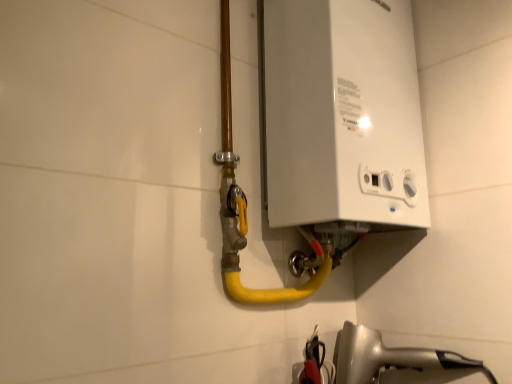
Question: Does white plastic boiler at upper right have a greater height compared to white glossy hairdryer at lower right?

Choices:
 (A) no
 (B) yes

Answer: (B)

Question: Can you confirm if white plastic boiler at upper right is smaller than white glossy hairdryer at lower right?

Choices:
 (A) yes
 (B) no

Answer: (B)

Question: Is white plastic boiler at upper right to the left of white glossy hairdryer at lower right from the viewer's perspective?

Choices:
 (A) no
 (B) yes

Answer: (B)

Question: From a real-world perspective, is white plastic boiler at upper right positioned under white glossy hairdryer at lower right based on gravity?

Choices:
 (A) yes
 (B) no

Answer: (B)

Question: Are white plastic boiler at upper right and white glossy hairdryer at lower right far apart?

Choices:
 (A) yes
 (B) no

Answer: (B)

Question: Is white plastic boiler at upper right further to camera compared to white glossy hairdryer at lower right?

Choices:
 (A) yes
 (B) no

Answer: (B)

Question: Is white glossy hairdryer at lower right at the left side of white plastic boiler at upper right?

Choices:
 (A) yes
 (B) no

Answer: (B)

Question: Is there a large distance between white glossy hairdryer at lower right and white plastic boiler at upper right?

Choices:
 (A) yes
 (B) no

Answer: (B)

Question: From a real-world perspective, is white glossy hairdryer at lower right on white plastic boiler at upper right?

Choices:
 (A) yes
 (B) no

Answer: (B)

Question: Is white glossy hairdryer at lower right wider than white plastic boiler at upper right?

Choices:
 (A) no
 (B) yes

Answer: (B)

Question: Can you confirm if white glossy hairdryer at lower right is positioned to the right of white plastic boiler at upper right?

Choices:
 (A) yes
 (B) no

Answer: (A)

Question: Are white glossy hairdryer at lower right and white plastic boiler at upper right beside each other?

Choices:
 (A) no
 (B) yes

Answer: (A)

Question: Considering the positions of point (279, 1) and point (428, 349), is point (279, 1) closer or farther from the camera than point (428, 349)?

Choices:
 (A) closer
 (B) farther

Answer: (A)